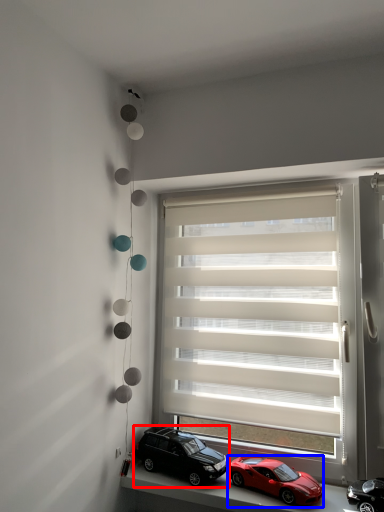
Question: Which point is further to the camera, car (highlighted by a red box) or car (highlighted by a blue box)?

Choices:
 (A) car
 (B) car

Answer: (A)